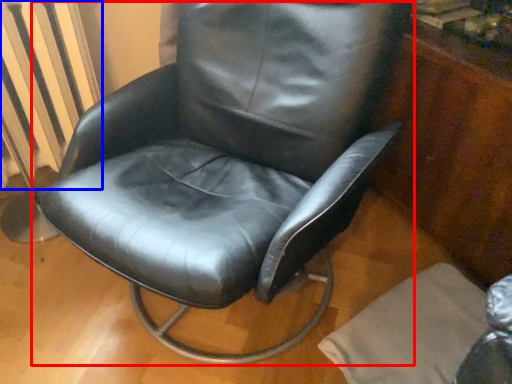
Question: Which of the following is the farthest to the observer, chair (highlighted by a red box) or radiator (highlighted by a blue box)?

Choices:
 (A) chair
 (B) radiator

Answer: (B)